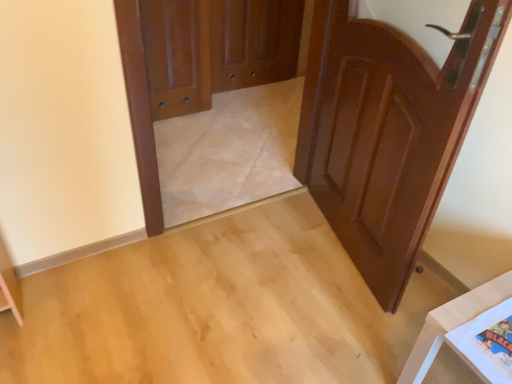
At what (x,y) coordinates should I click in order to perform the action: click on free space on the front side of brown wooden screen door at center. Please return your answer as a coordinate pair (x, y). The image size is (512, 384). Looking at the image, I should click on (245, 112).